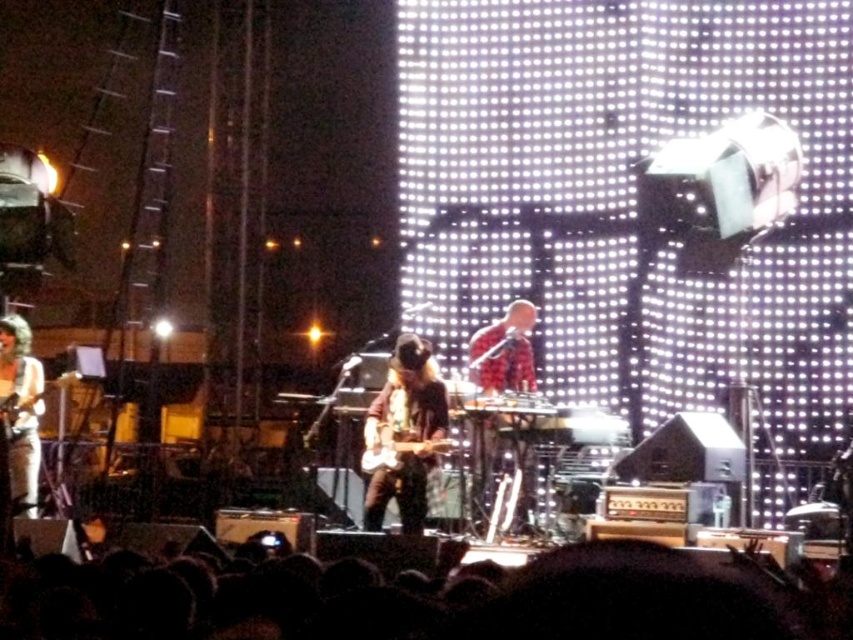
Question: Can you confirm if red plaid shirt at center is thinner than glossy wood electric guitar at lower left?

Choices:
 (A) no
 (B) yes

Answer: (A)

Question: Which is nearer to the glossy electric guitar at center?

Choices:
 (A) shiny black guitar at center
 (B) black hair at lower center
 (C) shiny black guitar at left

Answer: (A)

Question: Is red plaid shirt at center to the left of glossy electric guitar at center from the viewer's perspective?

Choices:
 (A) no
 (B) yes

Answer: (A)

Question: Which point is closer to the camera?

Choices:
 (A) (0, 385)
 (B) (524, 384)

Answer: (B)

Question: Does shiny black guitar at left have a lesser width compared to red plaid shirt at center?

Choices:
 (A) yes
 (B) no

Answer: (B)

Question: Which of the following is the farthest from the observer?

Choices:
 (A) (32, 360)
 (B) (299, 602)
 (C) (32, 406)
 (D) (520, 490)

Answer: (A)